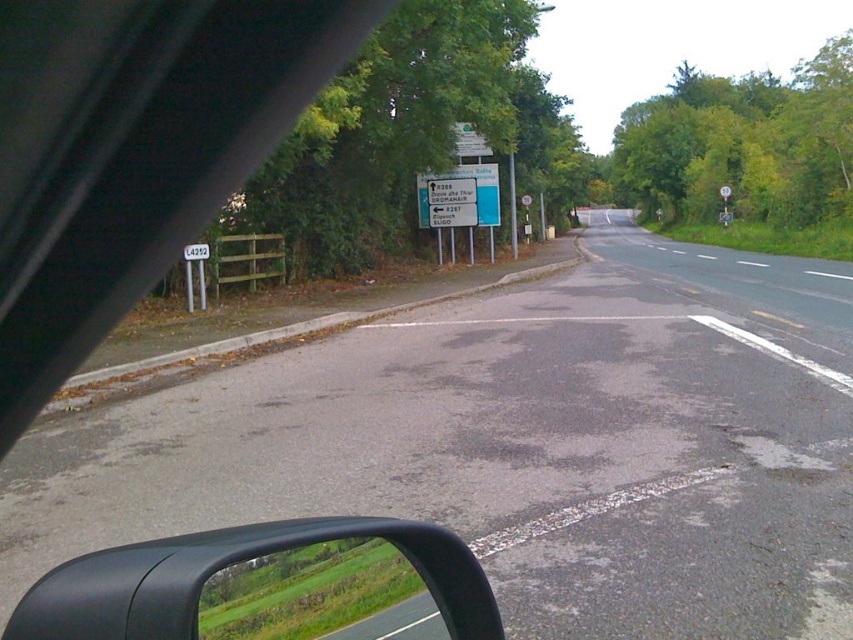
Question: Considering the relative positions of black rubber view mirror at lower left and white plastic sign at upper left in the image provided, where is black rubber view mirror at lower left located with respect to white plastic sign at upper left?

Choices:
 (A) right
 (B) left

Answer: (A)

Question: Is green matte side mirror at lower left wider than white plastic sign at upper left?

Choices:
 (A) no
 (B) yes

Answer: (A)

Question: Which is farther from the white plastic sign at upper left?

Choices:
 (A) green matte side mirror at lower left
 (B) black rubber view mirror at lower left

Answer: (A)

Question: Is green matte side mirror at lower left wider than white plastic sign at upper left?

Choices:
 (A) no
 (B) yes

Answer: (A)

Question: Which point is farther from the camera taking this photo?

Choices:
 (A) (403, 518)
 (B) (189, 244)

Answer: (B)

Question: Which object appears farthest from the camera in this image?

Choices:
 (A) black rubber view mirror at lower left
 (B) white plastic sign at upper left

Answer: (B)